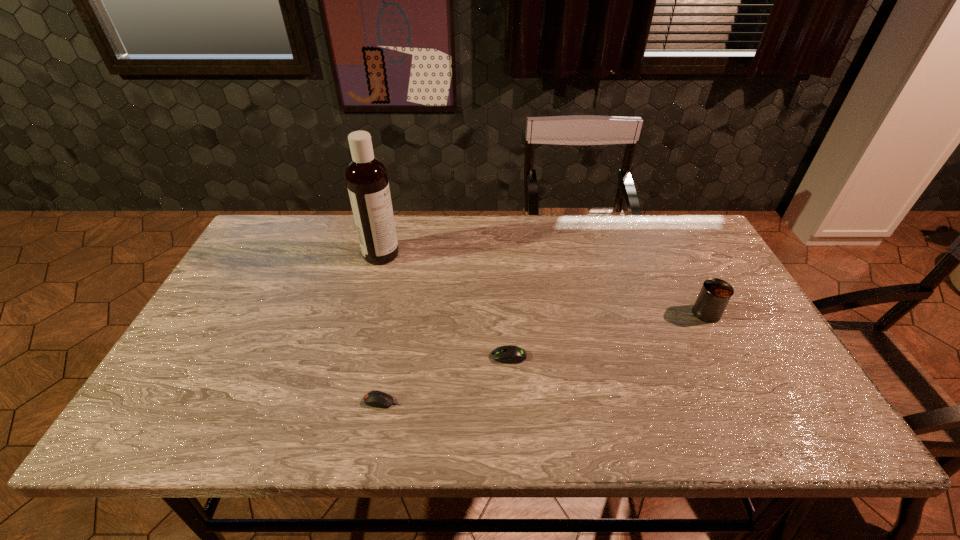
Where is `vacant space that satisfies the following two spatial constraints: 1. on the label side of the second tallest object; 2. on the right side of the farthest object`? The width and height of the screenshot is (960, 540). vacant space that satisfies the following two spatial constraints: 1. on the label side of the second tallest object; 2. on the right side of the farthest object is located at coordinates (366, 313).

You are a GUI agent. You are given a task and a screenshot of the screen. Output one action in this format:
    pyautogui.click(x=<x>, y=<y>)
    Task: Click on the free space that satisfies the following two spatial constraints: 1. on the label side of the nearest object; 2. on the right side of the farthest object
    The image size is (960, 540).
    Given the screenshot: What is the action you would take?
    pyautogui.click(x=343, y=401)